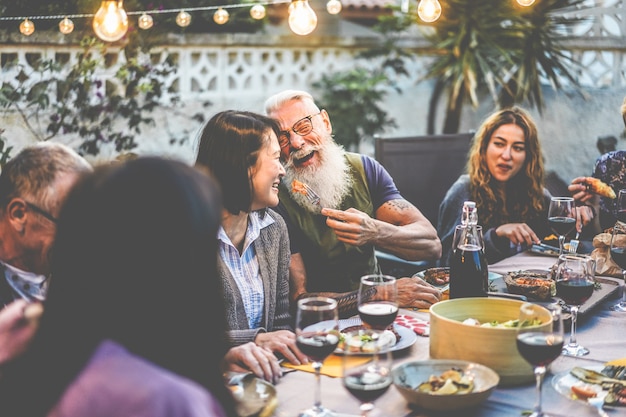
Where is `wine glasses`? wine glasses is located at coordinates (374, 296), (309, 328), (376, 356), (535, 339), (582, 266), (557, 204), (621, 201), (618, 251).